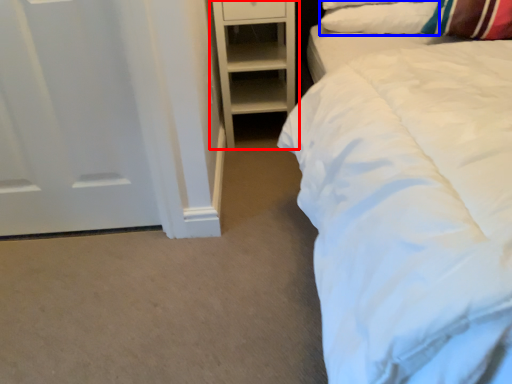
Question: Which object appears closest to the camera in this image, shelf (highlighted by a red box) or pillow (highlighted by a blue box)?

Choices:
 (A) shelf
 (B) pillow

Answer: (B)